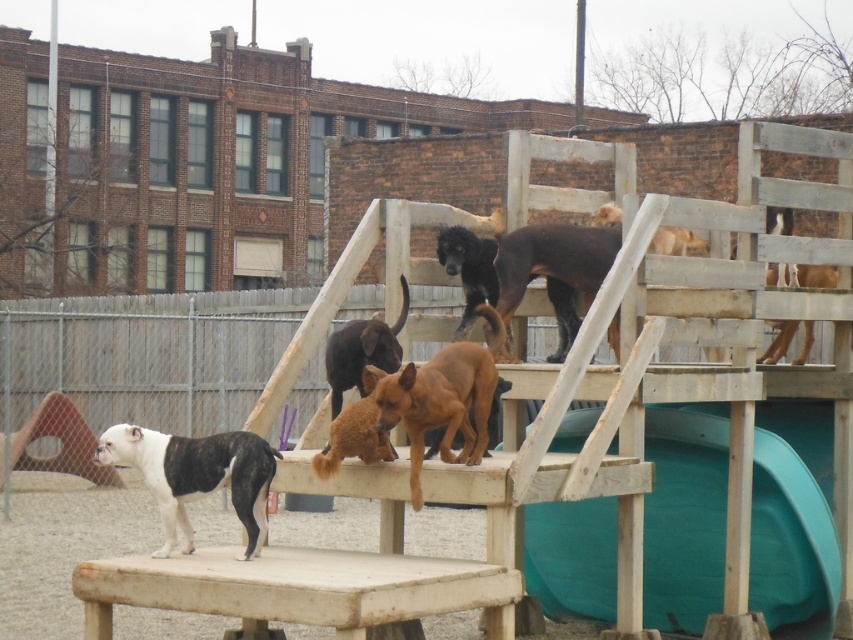
Is point (247, 460) positioned in front of point (416, 410)?

Yes.

Is white/black fur dog at lower left below brown matte dog at center?

Correct, white/black fur dog at lower left is located below brown matte dog at center.

This screenshot has height=640, width=853. Describe the element at coordinates (196, 476) in the screenshot. I see `white/black fur dog at lower left` at that location.

The image size is (853, 640). Identify the location of white/black fur dog at lower left. (196, 476).

Can you confirm if brown matte dog at center is shorter than black glossy dog at upper center?

Correct, brown matte dog at center is not as tall as black glossy dog at upper center.

Is point (447, 433) closer to camera compared to point (569, 260)?

Yes, point (447, 433) is closer to viewer.

This screenshot has height=640, width=853. What are the coordinates of `brown matte dog at center` in the screenshot? It's located at (440, 404).

What do you see at coordinates (363, 349) in the screenshot? I see `brown furry dog at center` at bounding box center [363, 349].

Is brown furry dog at center positioned behind brown furry dog at upper right?

No, it is in front of brown furry dog at upper right.

Is point (340, 394) less distant than point (799, 269)?

Yes, point (340, 394) is closer to viewer.

You are a GUI agent. You are given a task and a screenshot of the screen. Output one action in this format:
    pyautogui.click(x=<x>, y=<y>)
    Task: Click on the brown furry dog at center
    
    Given the screenshot: What is the action you would take?
    pyautogui.click(x=363, y=349)